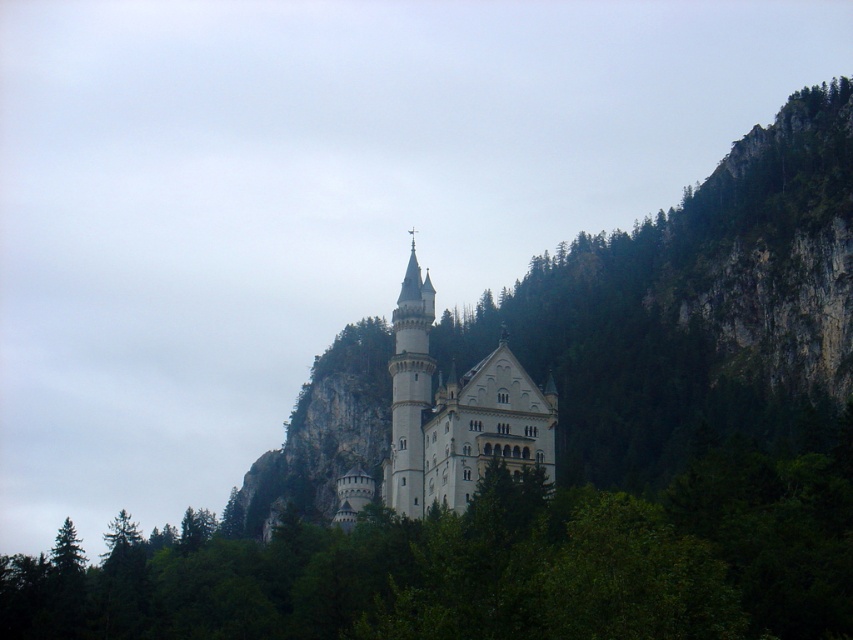
You are a bird flying over the castle and want to land on the highest point between the green leafy tree at center and the white stone tower at center. Which one should you choose?

The green leafy tree at center is much taller than the white stone tower at center, so you should choose the green leafy tree at center to land on the highest point.

You are an architect analyzing the layout of the scene. Based on the coordinates provided, where is the white stone castle at center positioned in the image?

The white stone castle at center is positioned at coordinates point (456,413).